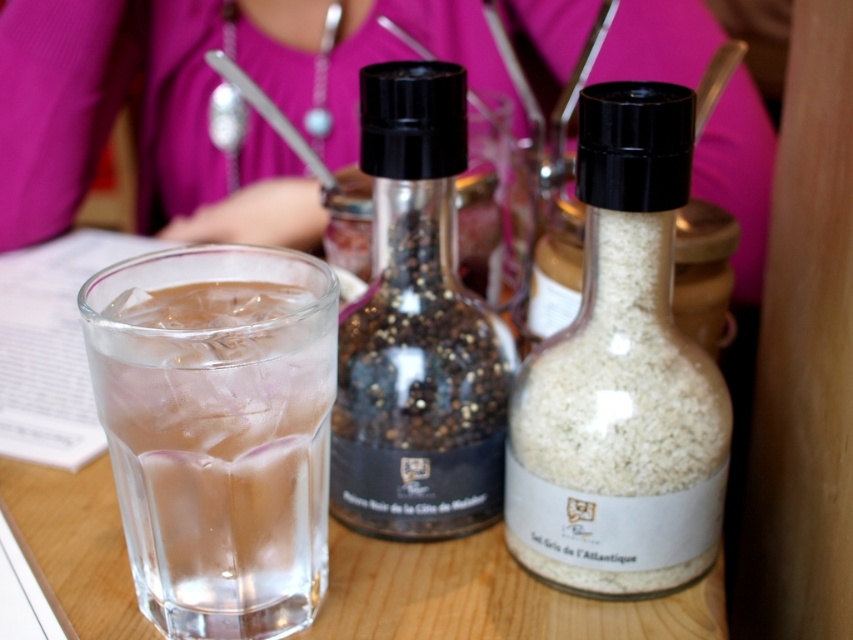
You are a customer at a restaurant and want to add salt to your meal. You have a white matte salt shaker at center and a clear glass at center on the table. Which one is taller?

The white matte salt shaker at center is taller than the clear glass at center.

You are a customer at the table and want to grab the item closest to you. Which point should you reach for, point at (637,588) or point at (283,628)?

Point at (283,628) is closer to you than point at (637,588), so you should reach for point at (283,628).

You are a customer at a cafe and want to reach the white matte salt shaker at center. Based on the table layout, which direction should you move your hand from the clear glass in front of you to grab the salt shaker?

The white matte salt shaker at center is located at point (621, 376), so you should move your hand towards the upper right direction from the clear glass to reach it.